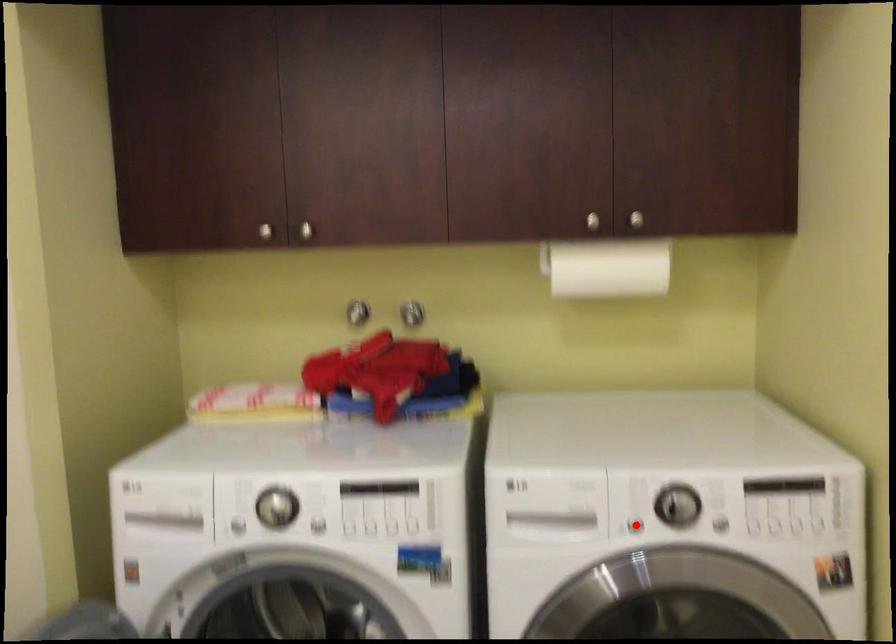
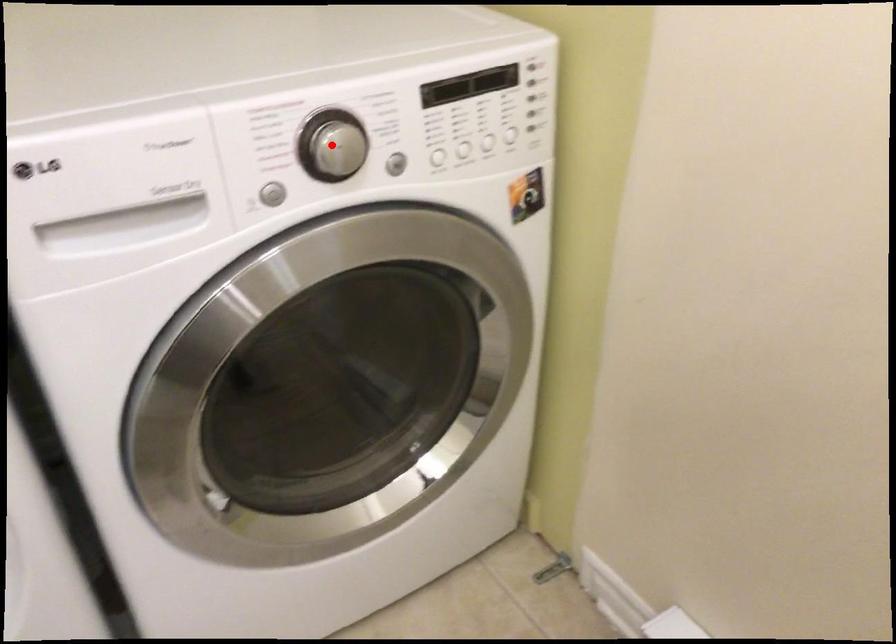
I am providing you with two images of the same scene from different viewpoints. A red point is marked on the first image and another point is marked on the second image. Is the red point in image1 aligned with the point shown in image2?

No